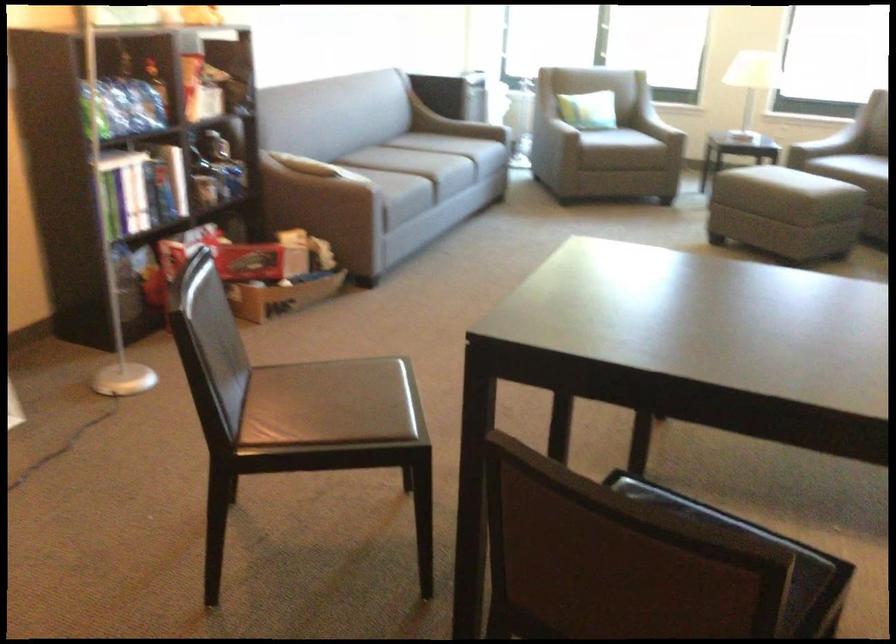
The width and height of the screenshot is (896, 644). What do you see at coordinates (785, 212) in the screenshot?
I see `a gray ottoman` at bounding box center [785, 212].